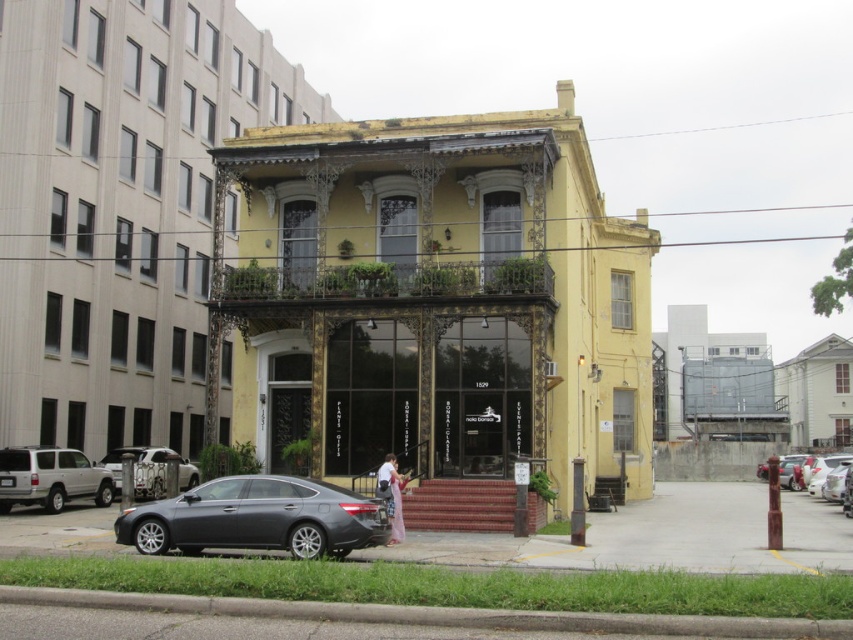
Can you confirm if satin gray sedan at lower left is smaller than metallic silver car at lower left?

Yes, satin gray sedan at lower left is smaller than metallic silver car at lower left.

Is satin gray sedan at lower left taller than metallic silver car at lower left?

In fact, satin gray sedan at lower left may be shorter than metallic silver car at lower left.

At what (x,y) coordinates should I click in order to perform the action: click on satin gray sedan at lower left. Please return your answer as a coordinate pair (x, y). The image size is (853, 640). Looking at the image, I should click on [x=257, y=518].

Can you confirm if satin gray sedan at lower left is positioned above pink fabric dress at lower center?

Incorrect, satin gray sedan at lower left is not positioned above pink fabric dress at lower center.

Is satin gray sedan at lower left to the left of pink fabric dress at lower center from the viewer's perspective?

Yes, satin gray sedan at lower left is to the left of pink fabric dress at lower center.

Where is `satin gray sedan at lower left`? This screenshot has width=853, height=640. satin gray sedan at lower left is located at coordinates (257, 518).

Image resolution: width=853 pixels, height=640 pixels. Identify the location of satin gray sedan at lower left. (257, 518).

Does silver metallic suv at lower left appear on the right side of metallic silver car at lower left?

Incorrect, silver metallic suv at lower left is not on the right side of metallic silver car at lower left.

Who is more forward, [51,451] or [114,467]?

Point [51,451] is in front.

This screenshot has height=640, width=853. What are the coordinates of `silver metallic suv at lower left` in the screenshot? It's located at (49, 477).

Image resolution: width=853 pixels, height=640 pixels. Identify the location of silver metallic suv at lower left. (49, 477).